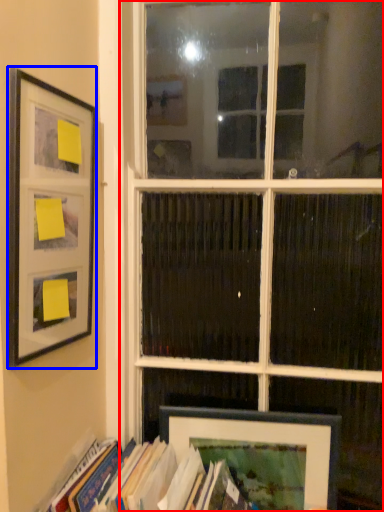
Question: Which point is closer to the camera, window (highlighted by a red box) or picture frame (highlighted by a blue box)?

Choices:
 (A) window
 (B) picture frame

Answer: (B)